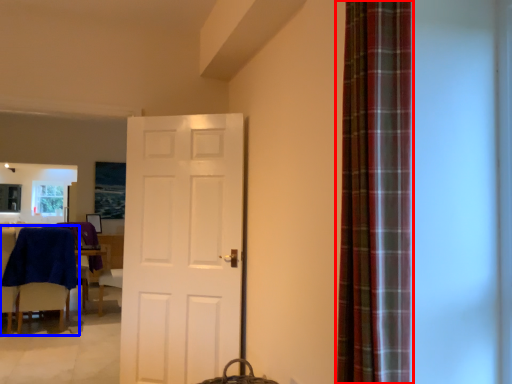
Question: Which object is closer to the camera taking this photo, curtain (highlighted by a red box) or chair (highlighted by a blue box)?

Choices:
 (A) curtain
 (B) chair

Answer: (A)